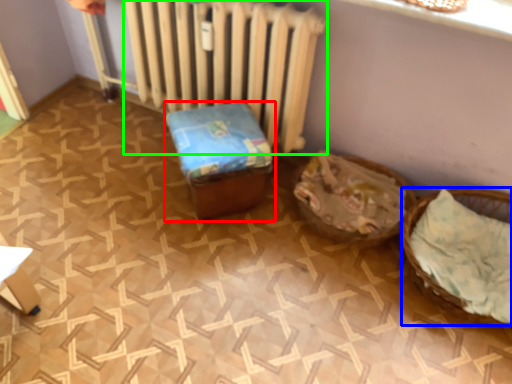
Question: Based on their relative distances, which object is nearer to furniture (highlighted by a red box)? Choose from basket (highlighted by a blue box) and radiator (highlighted by a green box).

Choices:
 (A) basket
 (B) radiator

Answer: (B)